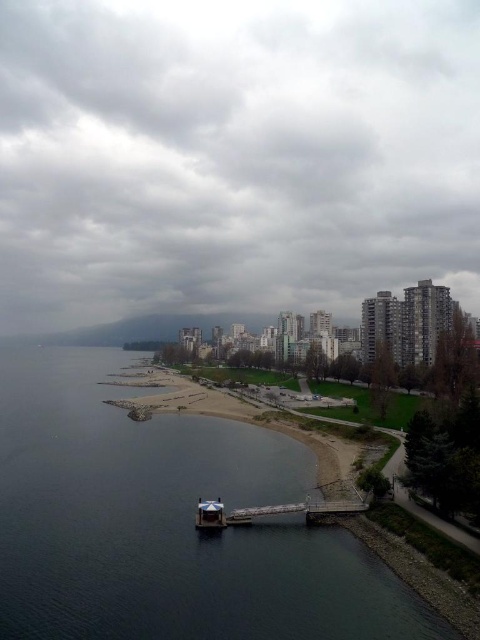
Based on the photo, can you confirm if wooden pier at lower center is positioned above metallic blue boat at lower center?

Actually, wooden pier at lower center is below metallic blue boat at lower center.

Is point (314, 502) farther from camera compared to point (218, 518)?

That is True.

This screenshot has height=640, width=480. Find the location of `wooden pier at lower center`. wooden pier at lower center is located at coordinates (297, 509).

Does dark gray concrete pier at lower left appear under wooden pier at lower center?

Yes.

You are a GUI agent. You are given a task and a screenshot of the screen. Output one action in this format:
    pyautogui.click(x=<x>, y=<y>)
    Task: Click on the dark gray concrete pier at lower left
    
    Given the screenshot: What is the action you would take?
    pyautogui.click(x=167, y=524)

Is cloudy sky at upper center taller than dark gray concrete pier at lower left?

Yes, cloudy sky at upper center is taller than dark gray concrete pier at lower left.

Does cloudy sky at upper center appear over dark gray concrete pier at lower left?

Yes.

Who is more distant from viewer, (364,198) or (214,588)?

The point (364,198) is more distant.

The width and height of the screenshot is (480, 640). Find the location of `cloudy sky at upper center`. cloudy sky at upper center is located at coordinates (233, 156).